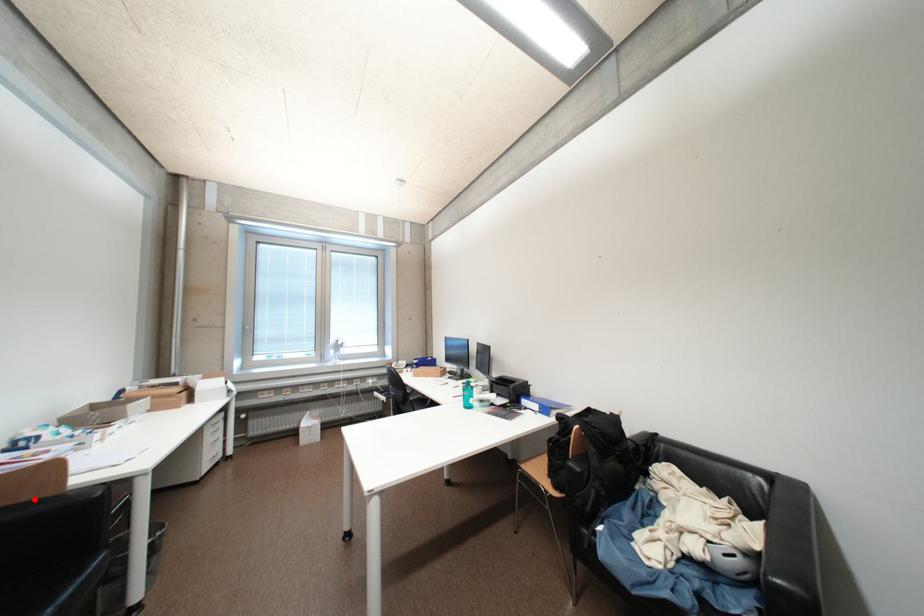
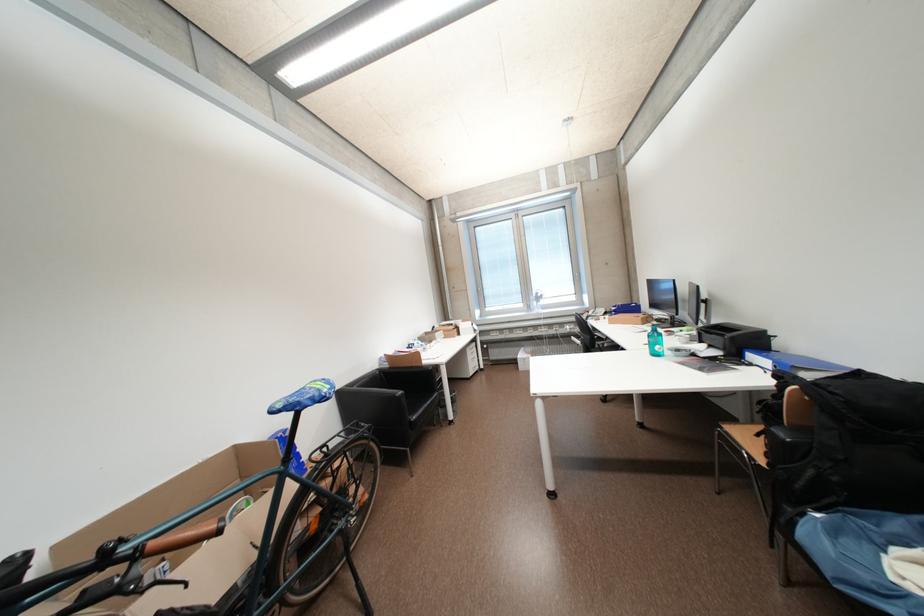
Find the pixel in the second image that matches the highlighted location in the first image.

(421, 367)